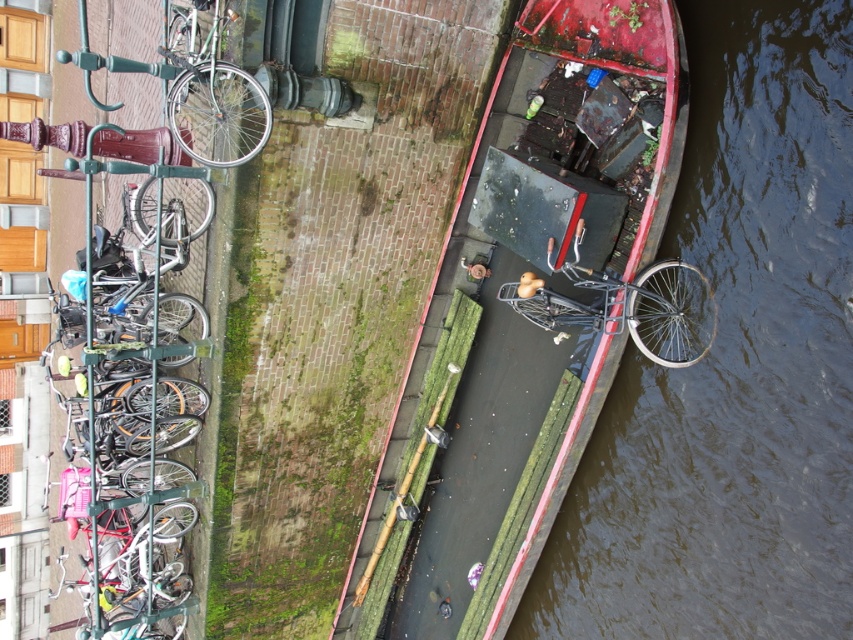
Which is more to the left, shiny black bicycle at center or shiny silver bicycle at upper left?

Positioned to the left is shiny silver bicycle at upper left.

Can you confirm if shiny black bicycle at center is thinner than shiny silver bicycle at upper left?

In fact, shiny black bicycle at center might be wider than shiny silver bicycle at upper left.

I want to click on shiny black bicycle at center, so click(x=630, y=307).

What are the coordinates of `shiny metallic bicycle at left` in the screenshot? It's located at (131, 419).

Identify the location of shiny metallic bicycle at left. (131, 419).

Is rusty metal boat at center above shiny silver bicycle at upper left?

Actually, rusty metal boat at center is below shiny silver bicycle at upper left.

Does point (660, 156) lie behind point (219, 100)?

Yes.

Where is `rusty metal boat at center`? The height and width of the screenshot is (640, 853). rusty metal boat at center is located at coordinates (544, 288).

Identify the location of rusty metal boat at center. The height and width of the screenshot is (640, 853). tap(544, 288).